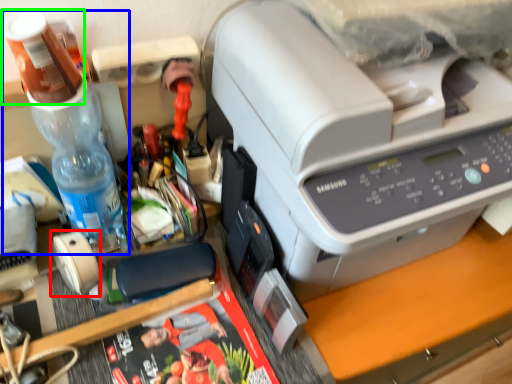
Question: Which is nearer to the tape (highlighted by a red box)? bottle (highlighted by a blue box) or stationery (highlighted by a green box).

Choices:
 (A) bottle
 (B) stationery

Answer: (A)